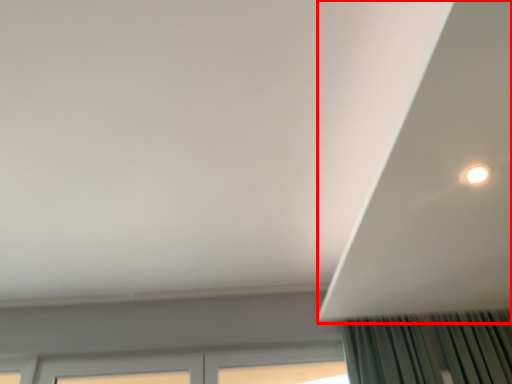
Question: From the image's perspective, where is exhaust hood (annotated by the red box) located in relation to window in the image?

Choices:
 (A) above
 (B) below

Answer: (A)